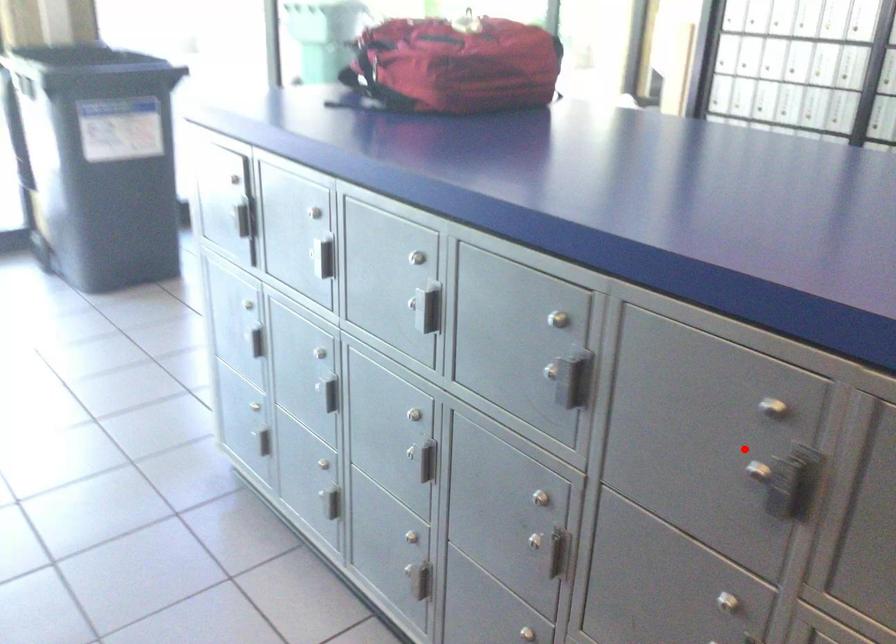
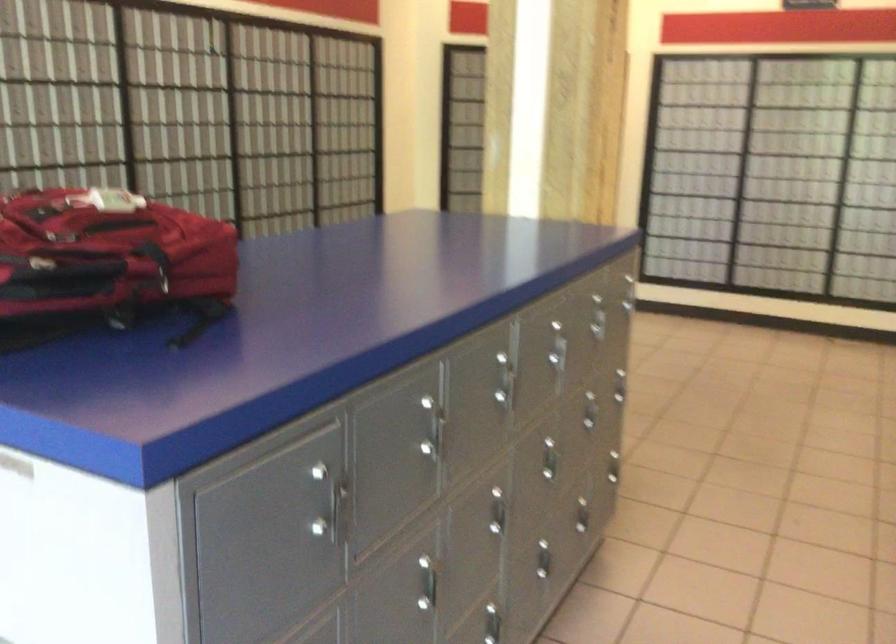
Question: I am providing you with two images of the same scene from different viewpoints. In image1, a red point is highlighted. Considering the same 3D point in image2, which of the following is correct?

Choices:
 (A) It is closer
 (B) It is farther

Answer: (B)